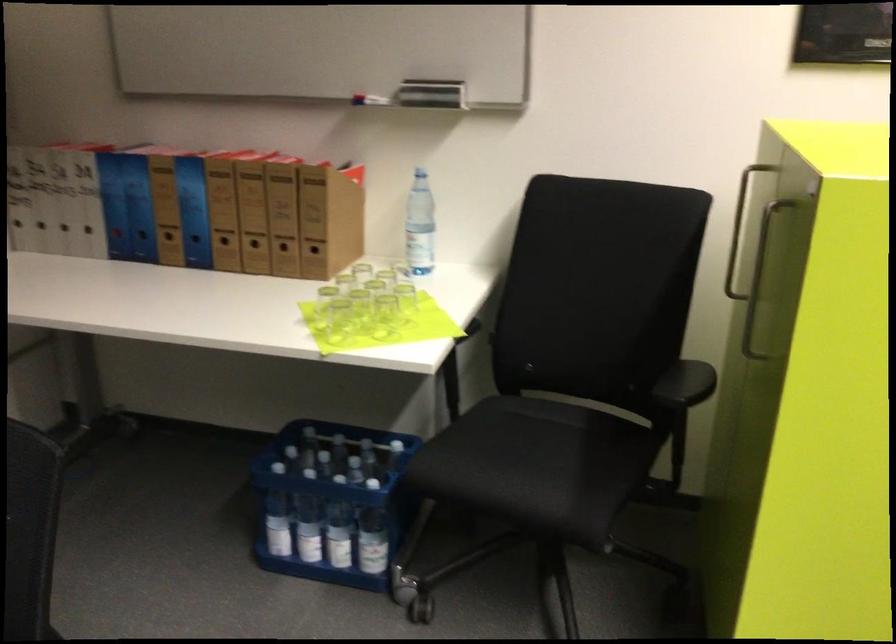
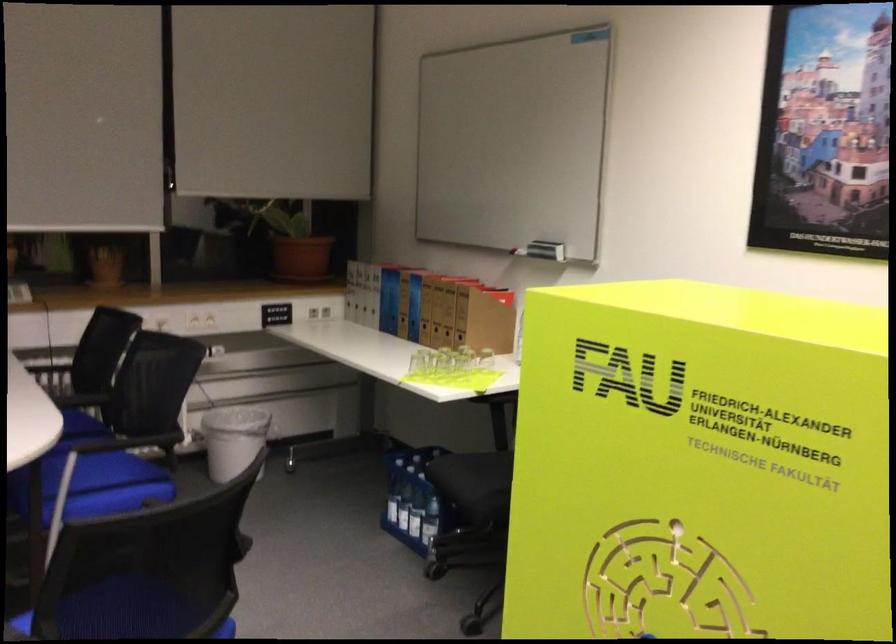
Question: I am providing you with two images of the same scene from different viewpoints. After the viewpoint changes to image2, which objects are now occluded?

Choices:
 (A) clear water bottle
 (B) white coat rack hook
 (C) blue binder spine hole
 (D) plastic water bottle

Answer: (A)